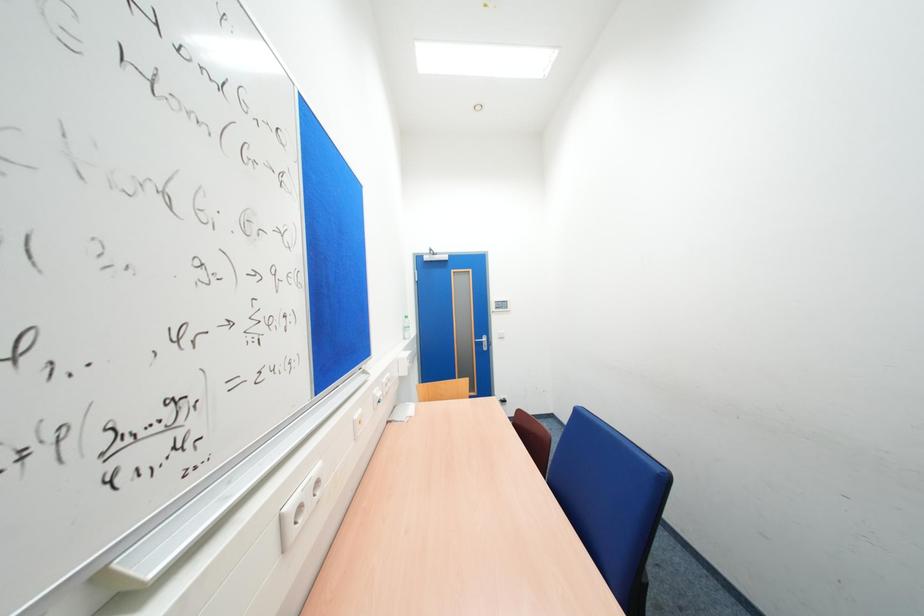
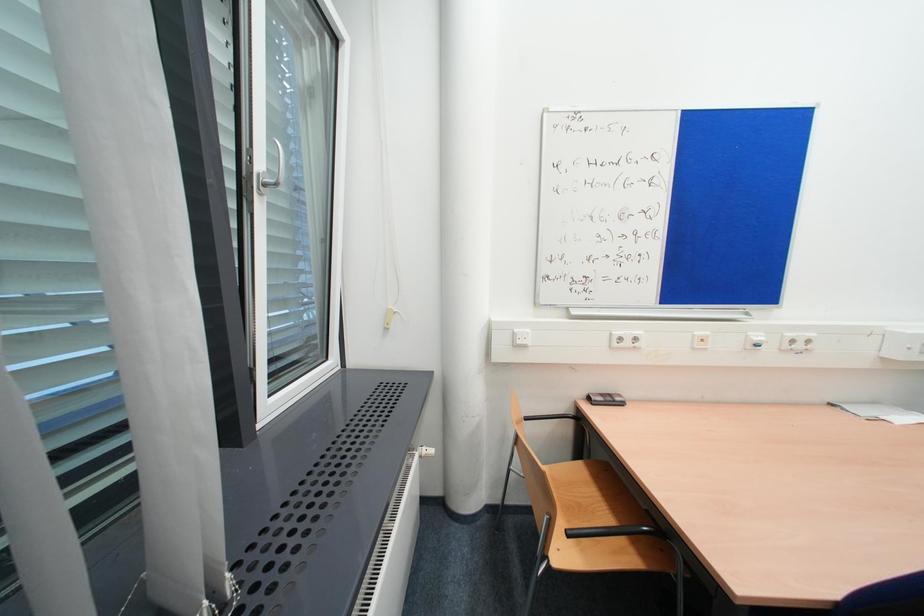
Question: The images are taken continuously from a first-person perspective. In which direction is your viewpoint rotating?

Choices:
 (A) Left
 (B) Right
 (C) Up
 (D) Down

Answer: (A)